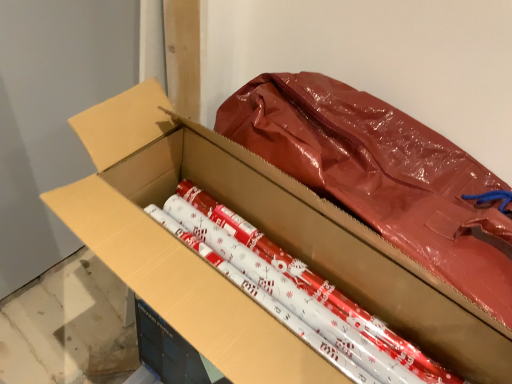
Describe the element at coordinates (311, 291) in the screenshot. This screenshot has height=384, width=512. I see `shiny metallic wrapping paper at center` at that location.

What is the approximate height of shiny metallic wrapping paper at center?

7.12 centimeters.

The height and width of the screenshot is (384, 512). I want to click on shiny metallic wrapping paper at center, so click(x=311, y=291).

Where is `matte cardboard box at center`? matte cardboard box at center is located at coordinates (266, 233).

Describe the element at coordinates (266, 233) in the screenshot. I see `matte cardboard box at center` at that location.

What is the approximate width of matte cardboard box at center?

matte cardboard box at center is 14.72 inches wide.

This screenshot has height=384, width=512. In order to click on shiny metallic wrapping paper at center in this screenshot , I will do `click(311, 291)`.

Based on their positions, is shiny metallic wrapping paper at center located to the left or right of matte cardboard box at center?

In the image, shiny metallic wrapping paper at center appears on the right side of matte cardboard box at center.

Is the position of shiny metallic wrapping paper at center less distant than that of matte cardboard box at center?

That is False.

Which is in front, point (211, 230) or point (214, 191)?

Positioned in front is point (211, 230).

From the image's perspective, is shiny metallic wrapping paper at center above or below matte cardboard box at center?

shiny metallic wrapping paper at center is situated higher than matte cardboard box at center in the image.

From a real-world perspective, which object stands above the other?

In real-world perspective, matte cardboard box at center is above.

Can you confirm if shiny metallic wrapping paper at center is wider than matte cardboard box at center?

Correct, the width of shiny metallic wrapping paper at center exceeds that of matte cardboard box at center.

Can you confirm if shiny metallic wrapping paper at center is shorter than matte cardboard box at center?

Correct, shiny metallic wrapping paper at center is not as tall as matte cardboard box at center.

Which of these two, shiny metallic wrapping paper at center or matte cardboard box at center, is bigger?

matte cardboard box at center is bigger.

Can we say shiny metallic wrapping paper at center lies outside matte cardboard box at center?

Actually, shiny metallic wrapping paper at center is within matte cardboard box at center.

Would you consider shiny metallic wrapping paper at center to be distant from matte cardboard box at center?

No.

Is matte cardboard box at center at the back of shiny metallic wrapping paper at center?

Yes, shiny metallic wrapping paper at center is facing away from matte cardboard box at center.

What's the angular difference between shiny metallic wrapping paper at center and matte cardboard box at center's facing directions?

89.6 degrees.

How far apart are shiny metallic wrapping paper at center and matte cardboard box at center?

shiny metallic wrapping paper at center is 4.08 inches from matte cardboard box at center.

Where is `box in front of the shiny metallic wrapping paper at center`? This screenshot has height=384, width=512. box in front of the shiny metallic wrapping paper at center is located at coordinates (266, 233).

Between matte cardboard box at center and shiny metallic wrapping paper at center, which one appears on the right side from the viewer's perspective?

Positioned to the right is shiny metallic wrapping paper at center.

Which object is closer to the camera taking this photo, matte cardboard box at center or shiny metallic wrapping paper at center?

Positioned in front is matte cardboard box at center.

Between point (96, 190) and point (353, 359), which one is positioned behind?

Point (353, 359)

From the image's perspective, is matte cardboard box at center above or below shiny metallic wrapping paper at center?

matte cardboard box at center is below shiny metallic wrapping paper at center.

From a real-world perspective, relative to shiny metallic wrapping paper at center, is matte cardboard box at center vertically above or below?

matte cardboard box at center is above shiny metallic wrapping paper at center.

Considering the relative sizes of matte cardboard box at center and shiny metallic wrapping paper at center in the image provided, is matte cardboard box at center wider than shiny metallic wrapping paper at center?

No, matte cardboard box at center is not wider than shiny metallic wrapping paper at center.

Considering the sizes of objects matte cardboard box at center and shiny metallic wrapping paper at center in the image provided, who is shorter, matte cardboard box at center or shiny metallic wrapping paper at center?

shiny metallic wrapping paper at center.

Looking at this image, can you confirm if matte cardboard box at center is smaller than shiny metallic wrapping paper at center?

No.

Is matte cardboard box at center not within shiny metallic wrapping paper at center?

Yes.

Is matte cardboard box at center directly adjacent to shiny metallic wrapping paper at center?

No, matte cardboard box at center is not in contact with shiny metallic wrapping paper at center.

Is matte cardboard box at center aimed at shiny metallic wrapping paper at center?

Yes.

Find the location of `crayon beneath the matte cardboard box at center (from a real-world perspective)`. crayon beneath the matte cardboard box at center (from a real-world perspective) is located at coordinates (311, 291).

Locate an element on the screen. This screenshot has width=512, height=384. crayon that appears on the right of matte cardboard box at center is located at coordinates click(311, 291).

At what (x,y) coordinates should I click in order to perform the action: click on box that appears in front of the shiny metallic wrapping paper at center. Please return your answer as a coordinate pair (x, y). This screenshot has width=512, height=384. Looking at the image, I should click on (266, 233).